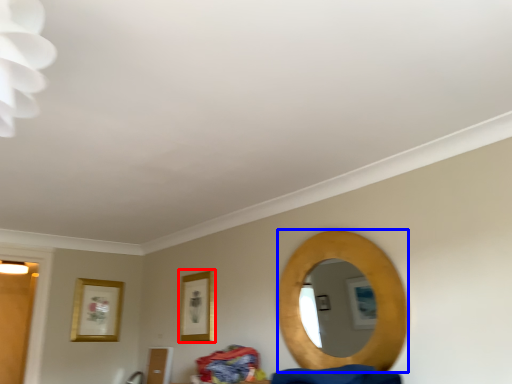
Question: Which object appears closest to the camera in this image, picture frame (highlighted by a red box) or mirror (highlighted by a blue box)?

Choices:
 (A) picture frame
 (B) mirror

Answer: (B)